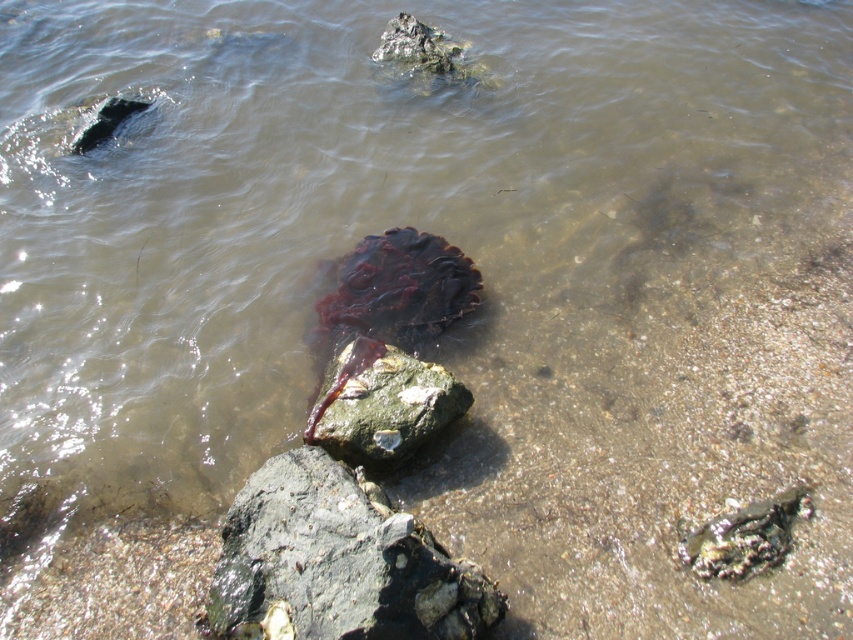
Question: Can you confirm if rough gray rock at center is positioned to the right of green mossy rock at center?

Choices:
 (A) no
 (B) yes

Answer: (A)

Question: Does rough gray rock at center appear on the left side of green mossy rock at center?

Choices:
 (A) no
 (B) yes

Answer: (B)

Question: Does rough gray rock at center have a lesser width compared to green mossy rock at center?

Choices:
 (A) yes
 (B) no

Answer: (B)

Question: Among these points, which one is farthest from the camera?

Choices:
 (A) (407, 566)
 (B) (370, 468)

Answer: (B)